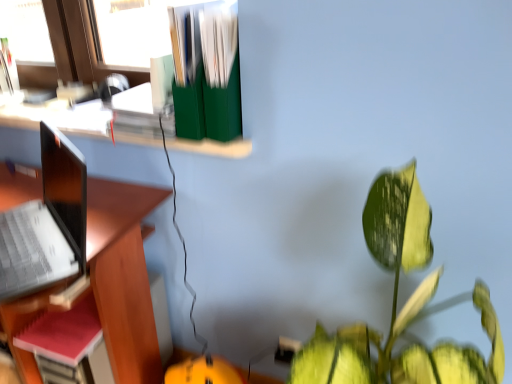
Question: In the image, is red matte notebook at left positioned in front of or behind green matte file folders at upper center?

Choices:
 (A) front
 (B) behind

Answer: (B)

Question: Considering the relative positions of red matte notebook at left and green matte file folders at upper center in the image provided, is red matte notebook at left to the left or to the right of green matte file folders at upper center?

Choices:
 (A) right
 (B) left

Answer: (B)

Question: Which of these objects is positioned farthest from the green matte file folders at upper center?

Choices:
 (A) sleek silver laptop at left
 (B) red matte notebook at left
 (C) green glossy leafy plant at lower right
 (D) wooden desk at left
 (E) green matte file organizer at upper center

Answer: (B)

Question: Estimate the real-world distances between objects in this image. Which object is farther from the green matte file organizer at upper center?

Choices:
 (A) green matte file folders at upper center
 (B) green glossy leafy plant at lower right
 (C) red matte notebook at left
 (D) sleek silver laptop at left
 (E) wooden desk at left

Answer: (B)